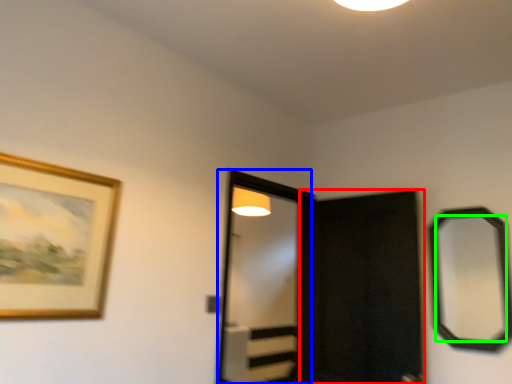
Question: Based on their relative distances, which object is nearer to screen door (highlighted by a red box)? Choose from screen door (highlighted by a blue box) and mirror (highlighted by a green box).

Choices:
 (A) screen door
 (B) mirror

Answer: (B)